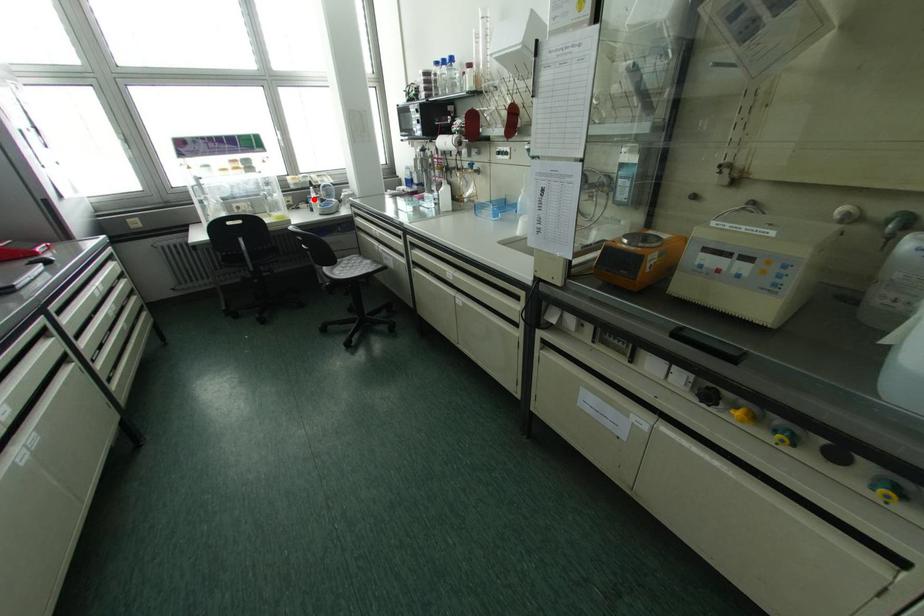
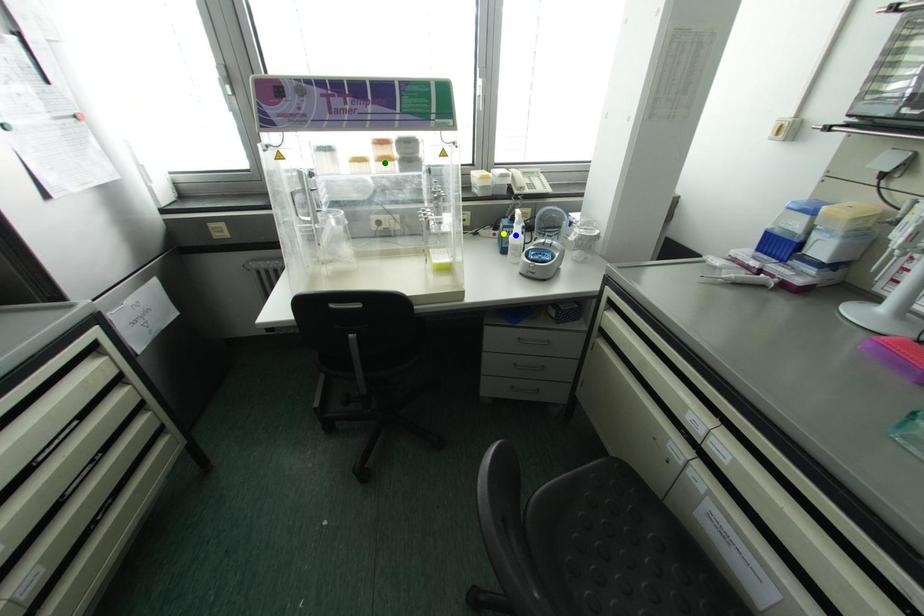
Question: I am providing you with two images of the same scene from different viewpoints. A red point is marked on the first image. You are given multiple points on the second image. Which point in image 2 is actually the same real-world point as the red point in image 1?

Choices:
 (A) blue point
 (B) green point
 (C) yellow point

Answer: (A)